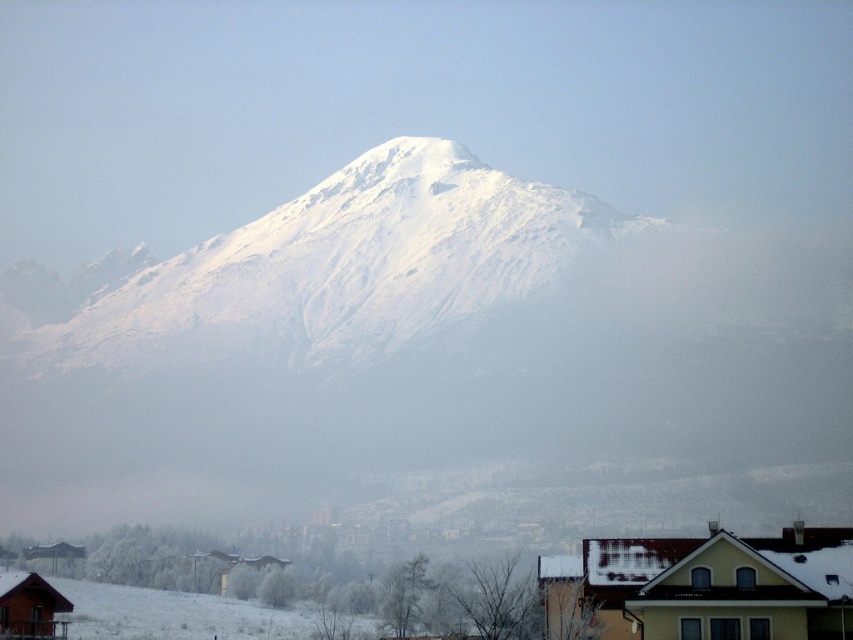
Question: Where is yellow matte house at lower right located in relation to wooden cabin at lower left in the image?

Choices:
 (A) left
 (B) right

Answer: (B)

Question: Does yellow matte house at lower right have a greater width compared to wooden cabin at lower left?

Choices:
 (A) yes
 (B) no

Answer: (A)

Question: Which of the following is the farthest from the observer?

Choices:
 (A) yellow matte house at lower right
 (B) wooden cabin at lower left

Answer: (B)

Question: Is yellow matte house at lower right above wooden cabin at lower left?

Choices:
 (A) no
 (B) yes

Answer: (B)

Question: Which of the following is the closest to the observer?

Choices:
 (A) (25, 600)
 (B) (738, 580)

Answer: (B)

Question: Which point is farther to the camera?

Choices:
 (A) wooden cabin at lower left
 (B) yellow matte house at lower right

Answer: (A)